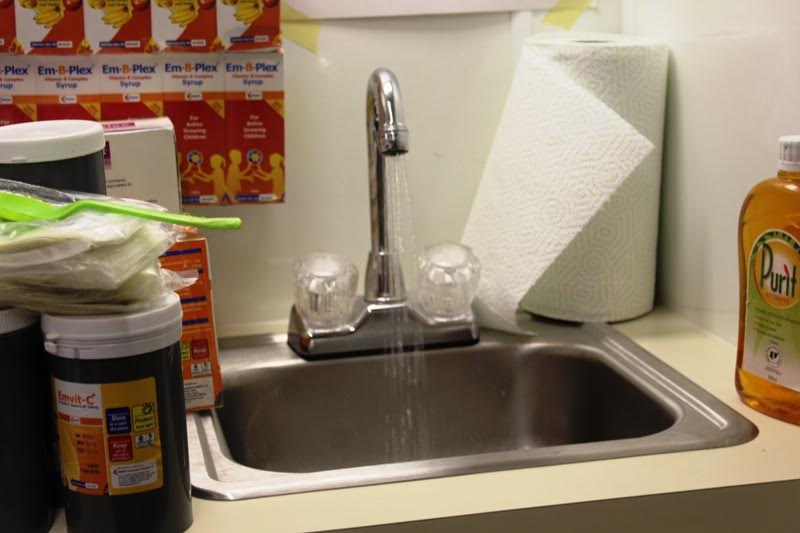
Locate an element on the screen. canister is located at coordinates (141, 377).